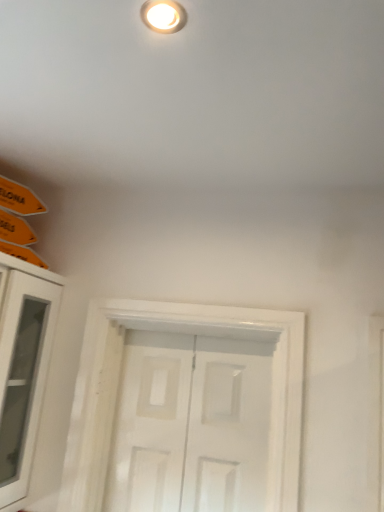
What do you see at coordinates (23, 366) in the screenshot? Image resolution: width=384 pixels, height=512 pixels. I see `white glass cabinet at left` at bounding box center [23, 366].

Where is `white glass cabinet at left`? The width and height of the screenshot is (384, 512). white glass cabinet at left is located at coordinates (23, 366).

What do you see at coordinates (190, 425) in the screenshot? This screenshot has height=512, width=384. I see `white matte door at center` at bounding box center [190, 425].

Where is `white matte door at center`? Image resolution: width=384 pixels, height=512 pixels. white matte door at center is located at coordinates (190, 425).

Where is `white glass cabinet at left`? The height and width of the screenshot is (512, 384). white glass cabinet at left is located at coordinates (23, 366).

Can you confirm if white matte door at center is positioned to the left of white glass cabinet at left?

No.

Who is more distant, white matte door at center or white glass cabinet at left?

white matte door at center.

Does point (201, 348) lie behind point (60, 277)?

No, it is not.

Looking at this image, from the image's perspective, is white matte door at center above white glass cabinet at left?

Incorrect, from the image's perspective, white matte door at center is lower than white glass cabinet at left.

From a real-world perspective, does white matte door at center sit lower than white glass cabinet at left?

Correct, in the physical world, white matte door at center is lower than white glass cabinet at left.

Is white matte door at center thinner than white glass cabinet at left?

Yes.

Which of these two, white matte door at center or white glass cabinet at left, stands shorter?

Standing shorter between the two is white matte door at center.

Is white matte door at center smaller than white glass cabinet at left?

Correct, white matte door at center occupies less space than white glass cabinet at left.

Can we say white matte door at center lies outside white glass cabinet at left?

Yes, white matte door at center is outside of white glass cabinet at left.

Are white matte door at center and white glass cabinet at left beside each other?

No, white matte door at center is not in contact with white glass cabinet at left.

Is white matte door at center looking in the opposite direction of white glass cabinet at left?

That's not correct — white matte door at center is not looking away from white glass cabinet at left.

Measure the distance between white matte door at center and white glass cabinet at left.

white matte door at center is 18.82 inches from white glass cabinet at left.

Identify the location of cabinetry that is on the left side of white matte door at center. This screenshot has height=512, width=384. (23, 366).

Can you confirm if white glass cabinet at left is positioned to the right of white matte door at center?

No, white glass cabinet at left is not to the right of white matte door at center.

Is white glass cabinet at left positioned in front of white matte door at center?

Yes, white glass cabinet at left is closer to the camera.

Considering the positions of points (13, 485) and (174, 375), is point (13, 485) closer to camera compared to point (174, 375)?

Yes, point (13, 485) is in front of point (174, 375).

From the image's perspective, is white glass cabinet at left positioned above or below white matte door at center?

From the image's perspective, white glass cabinet at left appears above white matte door at center.

From a real-world perspective, is white glass cabinet at left on top of white matte door at center?

Yes.

Considering the sizes of white glass cabinet at left and white matte door at center in the image, is white glass cabinet at left wider or thinner than white matte door at center?

Clearly, white glass cabinet at left has more width compared to white matte door at center.

Consider the image. Considering the sizes of objects white glass cabinet at left and white matte door at center in the image provided, who is shorter, white glass cabinet at left or white matte door at center?

white matte door at center is shorter.

Is white glass cabinet at left bigger than white matte door at center?

Yes.

Is white glass cabinet at left surrounding white matte door at center?

No.

Are white glass cabinet at left and white matte door at center located far from each other?

white glass cabinet at left is actually quite close to white matte door at center.

Is white glass cabinet at left facing towards white matte door at center?

Yes, white glass cabinet at left faces towards white matte door at center.

This screenshot has width=384, height=512. Identify the location of door behind the white glass cabinet at left. (190, 425).

The width and height of the screenshot is (384, 512). Identify the location of door that appears on the right of white glass cabinet at left. (190, 425).

Find the location of a particular element. This screenshot has height=512, width=384. cabinetry above the white matte door at center (from a real-world perspective) is located at coordinates (23, 366).